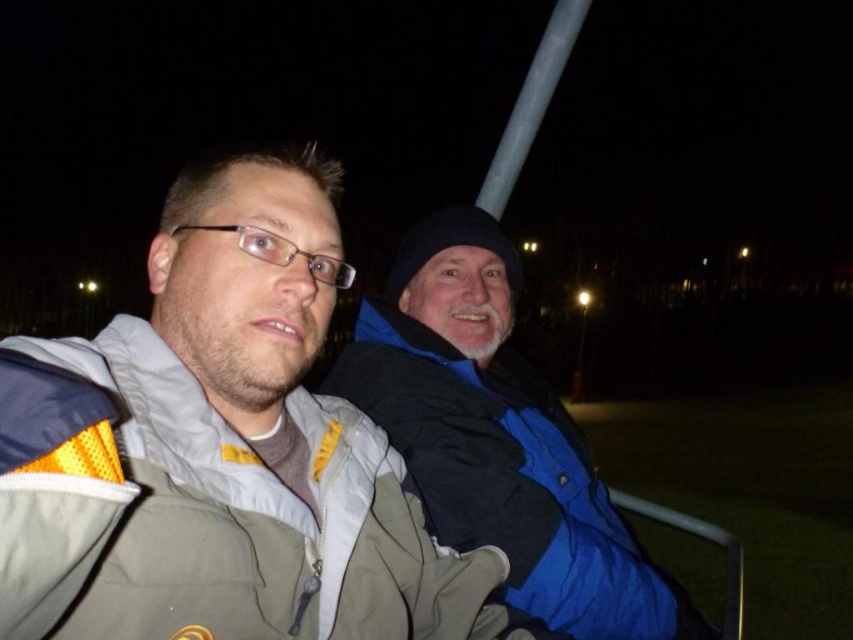
Question: Can you confirm if blue fleece jacket at right is bigger than metallic gray rail at lower right?

Choices:
 (A) no
 (B) yes

Answer: (B)

Question: Which point is farther from the camera taking this photo?

Choices:
 (A) (689, 532)
 (B) (20, 572)

Answer: (A)

Question: Does gray fleece jacket at center have a smaller size compared to metallic gray rail at lower right?

Choices:
 (A) yes
 (B) no

Answer: (B)

Question: Does gray fleece jacket at center appear under white glossy pole at upper center?

Choices:
 (A) no
 (B) yes

Answer: (B)

Question: Which of these objects is positioned farthest from the blue fleece jacket at right?

Choices:
 (A) metallic gray rail at lower right
 (B) gray fleece jacket at center

Answer: (A)

Question: Which point is closer to the camera taking this photo?

Choices:
 (A) (485, 205)
 (B) (396, 440)

Answer: (B)